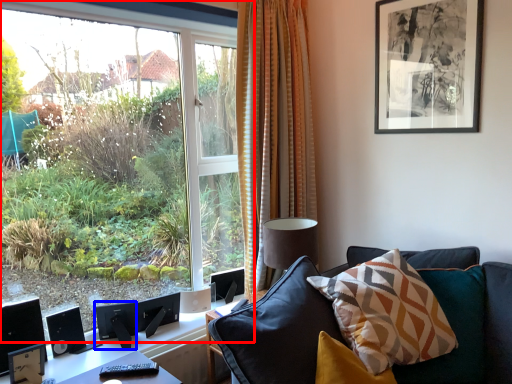
Question: Which of the following is the farthest to the observer, window (highlighted by a red box) or speaker (highlighted by a blue box)?

Choices:
 (A) window
 (B) speaker

Answer: (B)